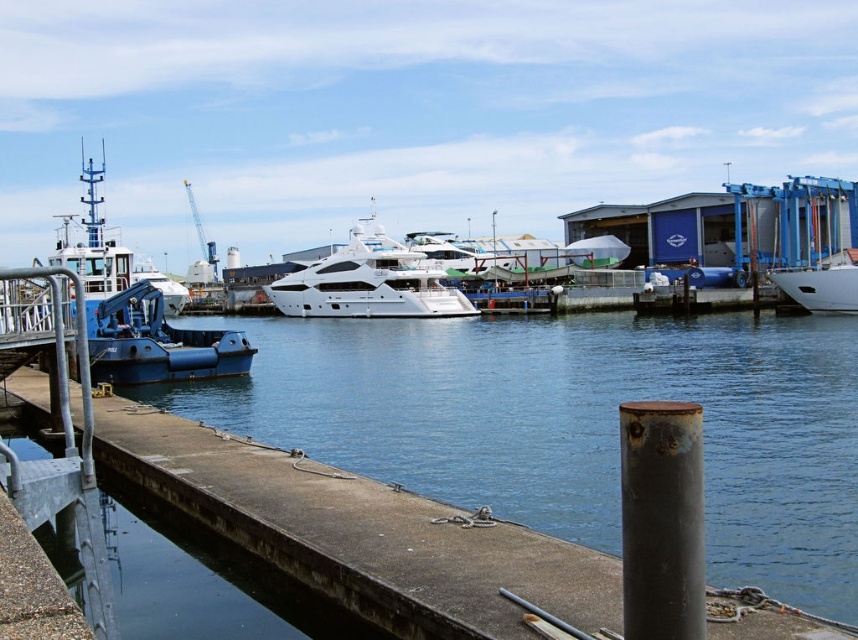
Question: Which object appears closest to the camera in this image?

Choices:
 (A) white glossy yacht at center
 (B) white glossy boat at right
 (C) smooth concrete dock at center

Answer: (C)

Question: Which point appears farthest from the camera in this image?

Choices:
 (A) (835, 296)
 (B) (559, 324)

Answer: (B)

Question: Is blue matte tugboat at left to the right of white glossy boat at right from the viewer's perspective?

Choices:
 (A) yes
 (B) no

Answer: (B)

Question: Is smooth concrete dock at center bigger than blue matte tugboat at left?

Choices:
 (A) yes
 (B) no

Answer: (B)

Question: Can you confirm if white glossy yacht at center is positioned to the left of white glossy boat at right?

Choices:
 (A) yes
 (B) no

Answer: (A)

Question: Considering the real-world distances, which object is farthest from the blue matte tugboat at left?

Choices:
 (A) white glossy boat at right
 (B) smooth concrete dock at center
 (C) white glossy yacht at center

Answer: (A)